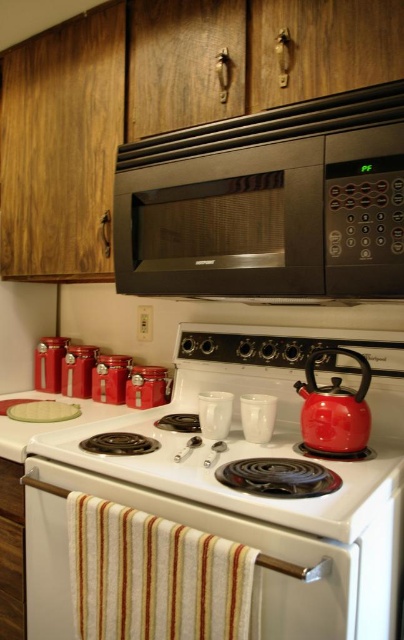
Which is more to the right, black matte microwave at upper center or shiny red teapot at stove top?

shiny red teapot at stove top

This screenshot has height=640, width=404. I want to click on black matte microwave at upper center, so click(x=265, y=218).

You are a GUI agent. You are given a task and a screenshot of the screen. Output one action in this format:
    pyautogui.click(x=<x>, y=<y>)
    Task: Click on the black matte microwave at upper center
    The image size is (404, 640).
    Given the screenshot: What is the action you would take?
    pyautogui.click(x=265, y=218)

Is black matte microwave at upper center positioned behind clear glass plate at upper center?

No, it is not.

Is black matte microwave at upper center taller than clear glass plate at upper center?

Yes, black matte microwave at upper center is taller than clear glass plate at upper center.

Describe the element at coordinates (265, 218) in the screenshot. The image size is (404, 640). I see `black matte microwave at upper center` at that location.

Identify the location of black matte microwave at upper center. This screenshot has width=404, height=640. (265, 218).

Which is more to the left, black matte microwave at upper center or white glossy gas stove at center?

From the viewer's perspective, white glossy gas stove at center appears more on the left side.

Does black matte microwave at upper center have a smaller size compared to white glossy gas stove at center?

Correct, black matte microwave at upper center occupies less space than white glossy gas stove at center.

Is point (378, 221) less distant than point (193, 458)?

Yes, it is in front of point (193, 458).

The width and height of the screenshot is (404, 640). I want to click on black matte microwave at upper center, so click(x=265, y=218).